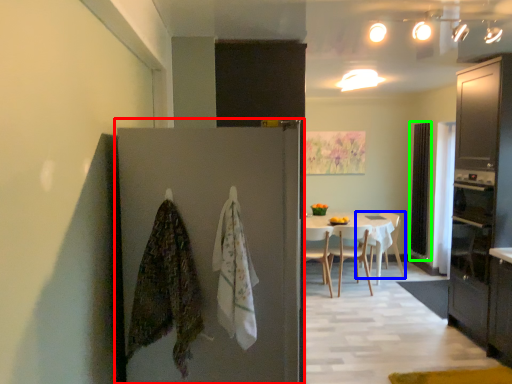
Question: Considering the real-world distances, which object is closest to door (highlighted by a red box)? chair (highlighted by a blue box) or screen door (highlighted by a green box).

Choices:
 (A) chair
 (B) screen door

Answer: (A)